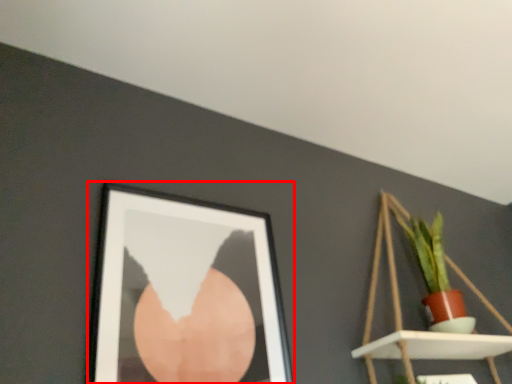
Question: From the image's perspective, what is the correct spatial relationship of picture frame (annotated by the red box) in relation to shelf?

Choices:
 (A) below
 (B) above

Answer: (B)